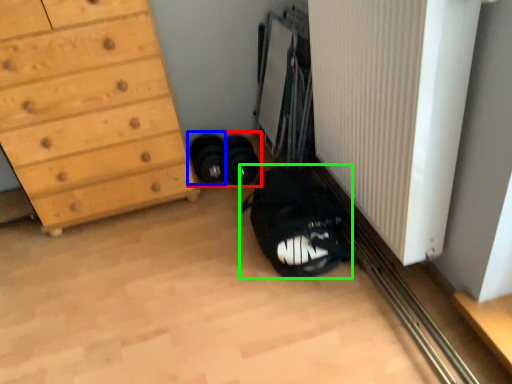
Question: Which is farther away from footwear (highlighted by a red box)? footwear (highlighted by a blue box) or shoulder bag (highlighted by a green box)?

Choices:
 (A) footwear
 (B) shoulder bag

Answer: (B)